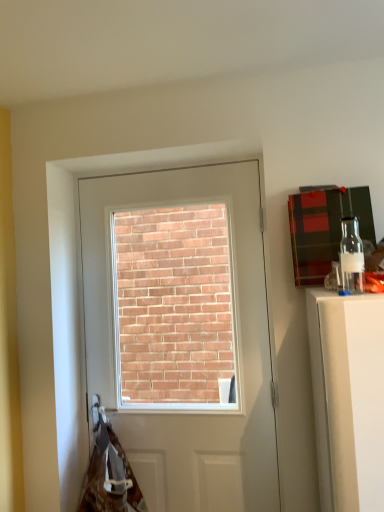
Question: Can you confirm if brown fabric at lower left is wider than white glossy door at center?

Choices:
 (A) no
 (B) yes

Answer: (B)

Question: Is brown fabric at lower left outside of white glossy door at center?

Choices:
 (A) yes
 (B) no

Answer: (A)

Question: Does brown fabric at lower left have a lesser height compared to white glossy door at center?

Choices:
 (A) yes
 (B) no

Answer: (A)

Question: Does brown fabric at lower left have a smaller size compared to white glossy door at center?

Choices:
 (A) no
 (B) yes

Answer: (B)

Question: Is brown fabric at lower left surrounding white glossy door at center?

Choices:
 (A) no
 (B) yes

Answer: (A)

Question: Is white glossy door at center taller or shorter than brown fabric at lower left?

Choices:
 (A) short
 (B) tall

Answer: (B)

Question: From the image's perspective, relative to brown fabric at lower left, is white glossy door at center above or below?

Choices:
 (A) below
 (B) above

Answer: (B)

Question: Is point (x=160, y=490) positioned closer to the camera than point (x=112, y=498)?

Choices:
 (A) closer
 (B) farther

Answer: (B)

Question: In terms of width, does white glossy door at center look wider or thinner when compared to brown fabric at lower left?

Choices:
 (A) thin
 (B) wide

Answer: (A)

Question: From the image's perspective, relative to white glossy door at center, is clear glass bottle at upper right above or below?

Choices:
 (A) above
 (B) below

Answer: (A)

Question: Is clear glass bottle at upper right inside or outside of white glossy door at center?

Choices:
 (A) outside
 (B) inside

Answer: (A)

Question: In terms of width, does clear glass bottle at upper right look wider or thinner when compared to white glossy door at center?

Choices:
 (A) thin
 (B) wide

Answer: (A)

Question: Is clear glass bottle at upper right in front of or behind white glossy door at center in the image?

Choices:
 (A) front
 (B) behind

Answer: (A)

Question: Considering the positions of brown fabric at lower left and white glossy door at center in the image, is brown fabric at lower left bigger or smaller than white glossy door at center?

Choices:
 (A) big
 (B) small

Answer: (B)

Question: Is brown fabric at lower left spatially inside white glossy door at center, or outside of it?

Choices:
 (A) inside
 (B) outside

Answer: (B)